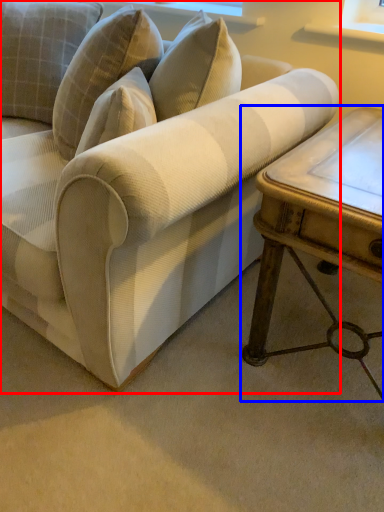
Question: Which object appears closest to the camera in this image, studio couch (highlighted by a red box) or table (highlighted by a blue box)?

Choices:
 (A) studio couch
 (B) table

Answer: (A)